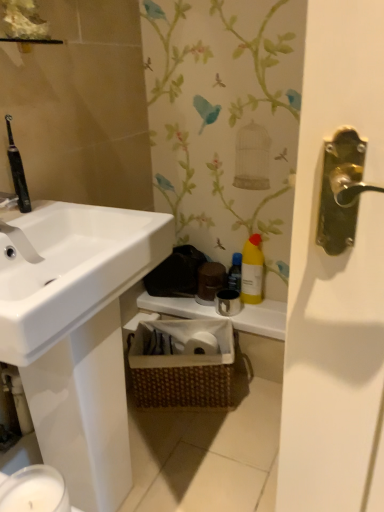
What do you see at coordinates (235, 273) in the screenshot? This screenshot has height=512, width=384. I see `yellow matte bottle at center` at bounding box center [235, 273].

The image size is (384, 512). What do you see at coordinates (262, 319) in the screenshot?
I see `white matte counter top at center` at bounding box center [262, 319].

In order to click on woven brown basket at center in this screenshot , I will do `click(183, 362)`.

Locate an element on the screen. This screenshot has height=512, width=384. yellow matte bottle at center is located at coordinates (235, 273).

Does point (187, 312) appear closer or farther from the camera than point (253, 245)?

Point (187, 312) is farther from the camera than point (253, 245).

Could you tell me if white matte counter top at center is turned towards yellow plastic bottle at upper right?

No, white matte counter top at center does not turn towards yellow plastic bottle at upper right.

Consider the image. Could you tell me if yellow plastic bottle at upper right is turned towards yellow matte bottle at center?

No, yellow plastic bottle at upper right is not oriented towards yellow matte bottle at center.

Who is smaller, yellow plastic bottle at upper right or yellow matte bottle at center?

With smaller size is yellow matte bottle at center.

I want to click on cleaning product lying in front of the yellow matte bottle at center, so tap(252, 271).

Between yellow matte bottle at center and white matte counter top at center, which one has larger width?

Wider between the two is white matte counter top at center.

Does point (237, 263) come behind point (142, 298)?

No.

Could you tell me if yellow matte bottle at center is facing white matte counter top at center?

No.

From a real-world perspective, is yellow matte bottle at center over white matte counter top at center?

Yes.

Is yellow matte bottle at center completely or partially inside woven brown basket at center?

No, yellow matte bottle at center is not a part of woven brown basket at center.

Is woven brown basket at center in front of yellow matte bottle at center?

Yes, woven brown basket at center is closer to the camera.

Is woven brown basket at center oriented towards yellow matte bottle at center?

No, woven brown basket at center is not aimed at yellow matte bottle at center.

Is woven brown basket at center in contact with yellow matte bottle at center?

No, woven brown basket at center is not with yellow matte bottle at center.

From a real-world perspective, which is physically below, yellow plastic bottle at upper right or white matte counter top at center?

white matte counter top at center, from a real-world perspective.

Is yellow plastic bottle at upper right in contact with white matte counter top at center?

No, yellow plastic bottle at upper right is not with white matte counter top at center.

Can you confirm if yellow plastic bottle at upper right is taller than white matte counter top at center?

Yes.

At what (x,y) coordinates should I click in order to perform the action: click on counter top below the yellow plastic bottle at upper right (from the image's perspective). Please return your answer as a coordinate pair (x, y). Looking at the image, I should click on (262, 319).

Is yellow matte bottle at center taller than yellow plastic bottle at upper right?

No.

Which is nearer, (233,269) or (252,275)?

The point (252,275) is in front.

Would you say yellow matte bottle at center is a long distance from yellow plastic bottle at upper right?

No.

Is white matte counter top at center oriented away from woven brown basket at center?

No, white matte counter top at center's orientation is not away from woven brown basket at center.

Which of these two, white matte counter top at center or woven brown basket at center, is smaller?

Smaller between the two is white matte counter top at center.

Between white matte counter top at center and woven brown basket at center, which one has less height?

With less height is white matte counter top at center.

Where is `cleaning product above the white matte counter top at center (from the image's perspective)`? cleaning product above the white matte counter top at center (from the image's perspective) is located at coordinates (252, 271).

The height and width of the screenshot is (512, 384). Find the location of `cleaning product above the yellow matte bottle at center (from a real-world perspective)`. cleaning product above the yellow matte bottle at center (from a real-world perspective) is located at coordinates (252, 271).

Based on their spatial positions, is yellow plastic bottle at upper right or white matte counter top at center closer to woven brown basket at center?

white matte counter top at center.

From the image, which object appears to be nearer to white matte counter top at center, yellow matte bottle at center or woven brown basket at center?

Among the two, woven brown basket at center is located nearer to white matte counter top at center.

Based on their spatial positions, is woven brown basket at center or yellow plastic bottle at upper right closer to yellow matte bottle at center?

yellow plastic bottle at upper right.

Considering their positions, is woven brown basket at center positioned further to white matte counter top at center than yellow matte bottle at center?

yellow matte bottle at center is further to white matte counter top at center.

Based on the photo, which object lies further to the anchor point yellow plastic bottle at upper right, yellow matte bottle at center or woven brown basket at center?

Based on the image, woven brown basket at center appears to be further to yellow plastic bottle at upper right.

Looking at the image, which one is located further to yellow plastic bottle at upper right, woven brown basket at center or yellow matte bottle at center?

woven brown basket at center.

Estimate the real-world distances between objects in this image. Which object is closer to yellow plastic bottle at upper right, white matte counter top at center or woven brown basket at center?

white matte counter top at center is closer to yellow plastic bottle at upper right.

When comparing their distances from white matte counter top at center, does woven brown basket at center or yellow plastic bottle at upper right seem closer?

yellow plastic bottle at upper right.

This screenshot has width=384, height=512. I want to click on counter top between yellow matte bottle at center and woven brown basket at center in the vertical direction, so click(x=262, y=319).

At what (x,y) coordinates should I click in order to perform the action: click on bottle between yellow plastic bottle at upper right and white matte counter top at center in the up-down direction. Please return your answer as a coordinate pair (x, y). This screenshot has width=384, height=512. Looking at the image, I should click on (235, 273).

Where is `counter top between yellow plastic bottle at upper right and woven brown basket at center from top to bottom`? The image size is (384, 512). counter top between yellow plastic bottle at upper right and woven brown basket at center from top to bottom is located at coordinates (262, 319).

You are a GUI agent. You are given a task and a screenshot of the screen. Output one action in this format:
    pyautogui.click(x=<x>, y=<y>)
    Task: Click on the bottle between yellow plastic bottle at upper right and woven brown basket at center in the vertical direction
    This screenshot has width=384, height=512.
    Given the screenshot: What is the action you would take?
    pyautogui.click(x=235, y=273)